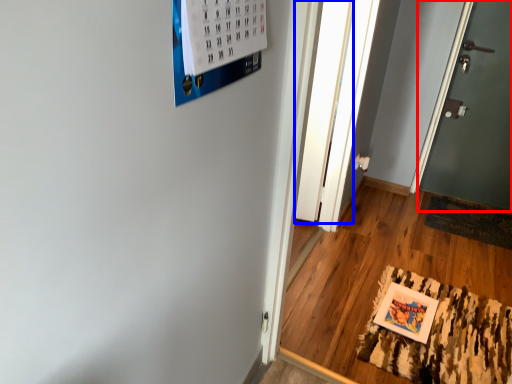
Question: Which of the following is the farthest to the observer, door (highlighted by a red box) or glass door (highlighted by a blue box)?

Choices:
 (A) door
 (B) glass door

Answer: (A)